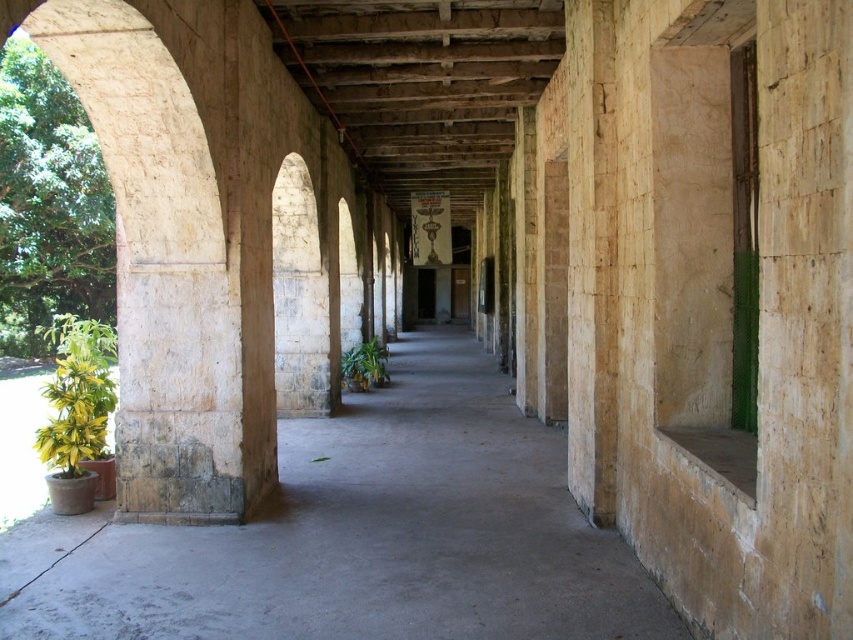
You are standing at the entrance of the corridor and want to place a new bench. The bench requires a clear space of 1.5 meters in front of it. The green leafy plant at left is located at point (77,396). Is there enough space in front of the plant to place the bench?

The green leafy plant at left is located at point (77,396). Since the corridor is long and open, there should be sufficient space in front of the plant to place the bench with the required 1.5 meters clearance.

You are standing at the entrance of the corridor and want to place a new potted plant exactly where the smooth concrete floor at center is located. According to the image, where should you place the new potted plant?

The smooth concrete floor at center is located at point (358, 536), so you should place the new potted plant at that coordinate.